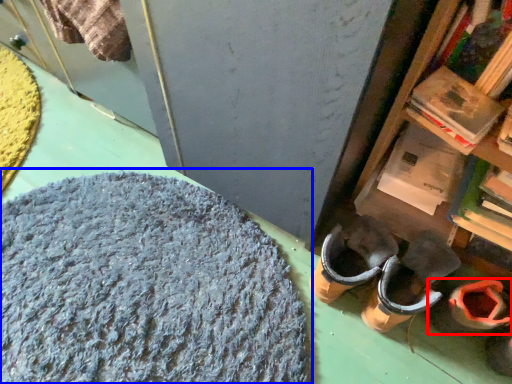
Question: Which object is further to the camera taking this photo, footwear (highlighted by a red box) or wool (highlighted by a blue box)?

Choices:
 (A) footwear
 (B) wool

Answer: (A)